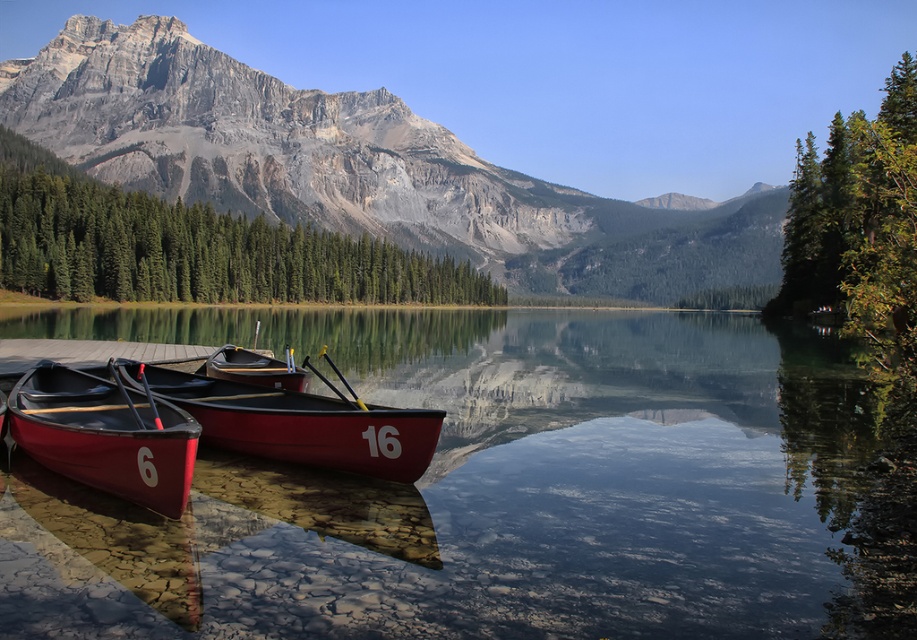
Question: Which point appears farthest from the camera in this image?

Choices:
 (A) (472, 256)
 (B) (256, 365)

Answer: (A)

Question: Which of these objects is positioned closest to the matte red canoe at center?

Choices:
 (A) transparent glass water at center
 (B) matte red canoe at left
 (C) matte gray rock at upper center

Answer: (B)

Question: Observing the image, what is the correct spatial positioning of transparent glass water at center in reference to matte red canoe at left?

Choices:
 (A) left
 (B) right

Answer: (B)

Question: Is matte red canoe at left above matte red canoe at center?

Choices:
 (A) no
 (B) yes

Answer: (B)

Question: Is matte gray rock at upper center behind matte red canoe at center?

Choices:
 (A) no
 (B) yes

Answer: (B)

Question: Which object appears closest to the camera in this image?

Choices:
 (A) matte black canoe at center
 (B) matte red canoe at left
 (C) matte gray rock at upper center

Answer: (B)